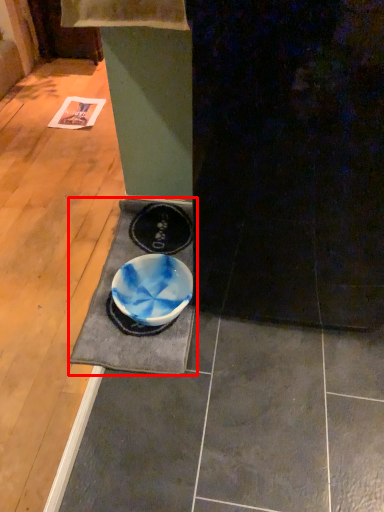
Question: From the image's perspective, where is doormat (annotated by the red box) located relative to bowl?

Choices:
 (A) below
 (B) above

Answer: (B)